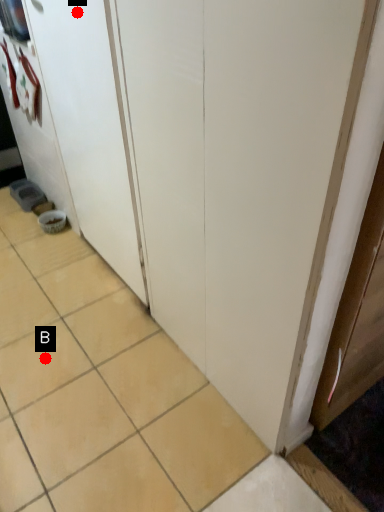
Question: Two points are circled on the image, labeled by A and B beside each circle. Which point appears farthest from the camera in this image?

Choices:
 (A) A is further
 (B) B is further

Answer: (B)